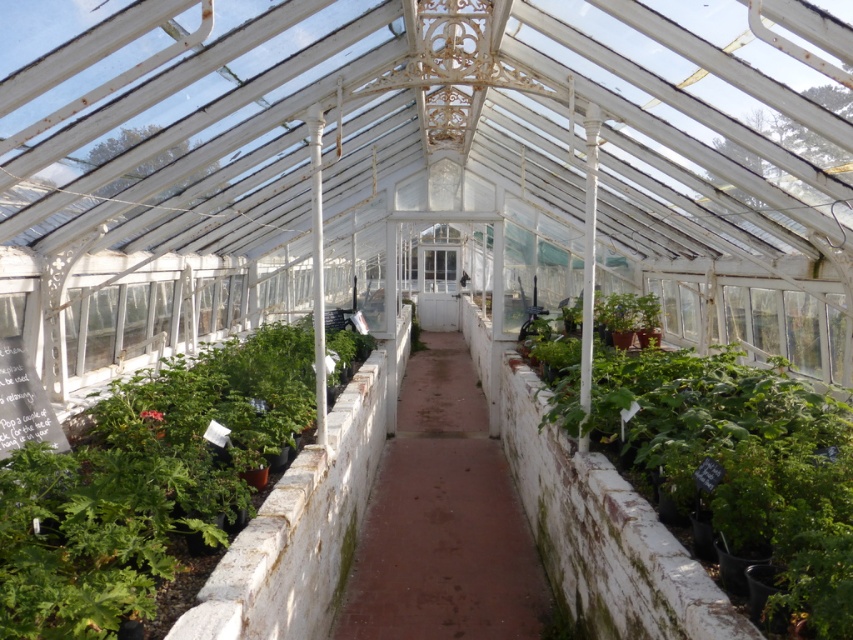
Describe the element at coordinates (143, 484) in the screenshot. I see `green leafy plant at left` at that location.

Is point (190, 513) positioned in front of point (779, 468)?

No, it is behind (779, 468).

Identify the location of green leafy plant at left. (143, 484).